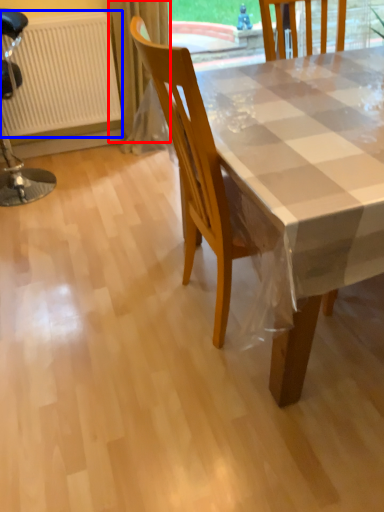
Question: Which point is further to the camera, curtain (highlighted by a red box) or radiator (highlighted by a blue box)?

Choices:
 (A) curtain
 (B) radiator

Answer: (A)